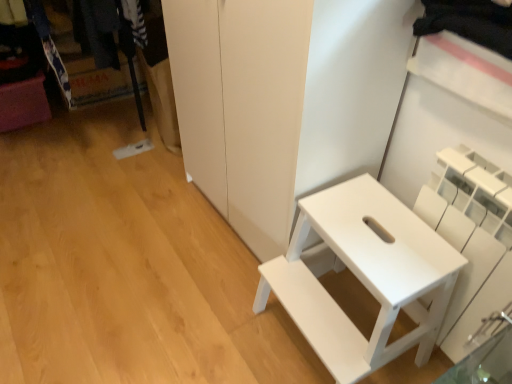
Where is `vacant position to the left of white matte step stool at right`? vacant position to the left of white matte step stool at right is located at coordinates (220, 321).